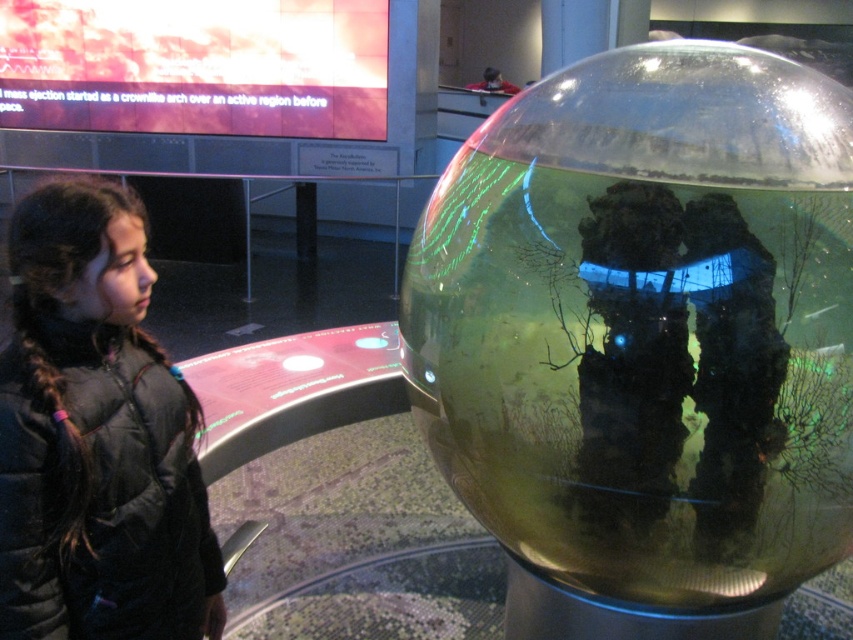
You are a visitor in the museum and want to take a photo of the transparent glass sphere at center without the black puffy jacket at left blocking the view. Is it possible to do so?

The transparent glass sphere at center is in front of the black puffy jacket at left, so you can take a photo of the transparent glass sphere at center without the black puffy jacket at left blocking the view because the sphere is closer to you than the jacket.

You are standing in the museum and want to take a photo of the transparent glass sphere at center while also including the black puffy jacket at left in the frame. Which direction should you position yourself relative to the sphere to ensure both objects are in the shot?

Position yourself to the left of the transparent glass sphere at center so that the black puffy jacket at left is visible in the frame. Since the transparent glass sphere at center is to the right of the black puffy jacket at left, moving to the left side of the sphere allows both objects to be captured in the photo.

You are an event planner setting up a photo booth area in the museum. You need to place a 2m wide backdrop behind the transparent glass sphere at center and the black puffy jacket at left. Can the backdrop accommodate both objects without overlapping?

The transparent glass sphere at center is wider than the black puffy jacket at left. Since the backdrop is 2m wide, it can accommodate both objects as long as their combined width does not exceed 2 meters. However, without knowing the exact widths of both items, we cannot confirm if they will fit together on the backdrop.